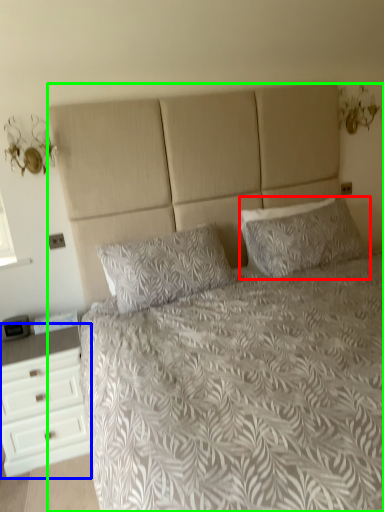
Question: Considering the real-world distances, which object is farthest from pillow (highlighted by a red box)? chest of drawers (highlighted by a blue box) or bed (highlighted by a green box)?

Choices:
 (A) chest of drawers
 (B) bed

Answer: (A)